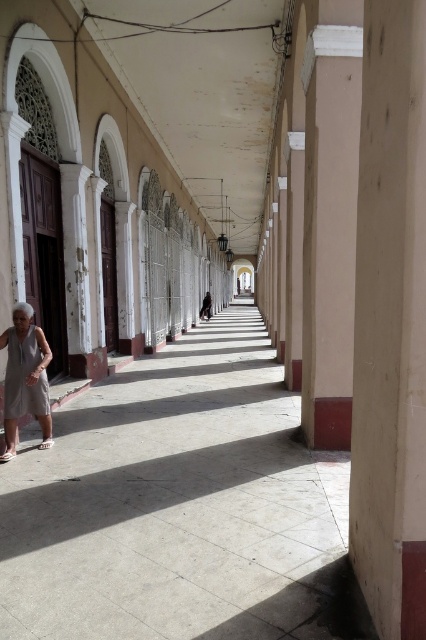
Question: Is smooth concrete pillar at center positioned in front of gray fabric dress at lower left?

Choices:
 (A) no
 (B) yes

Answer: (B)

Question: Does smooth concrete pillar at center appear on the right side of gray fabric dress at lower left?

Choices:
 (A) yes
 (B) no

Answer: (A)

Question: Does smooth concrete pillar at center appear under gray fabric dress at lower left?

Choices:
 (A) yes
 (B) no

Answer: (B)